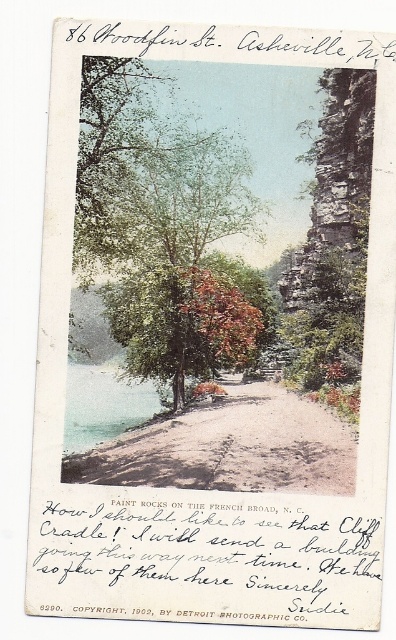
You are a hiker planning to walk along the sandy dirt path at center in the Paint Rocks area. You notice a green leafy tree at center nearby. Which object occupies more space in the scene?

The green leafy tree at center is bigger than the sandy dirt path at center, so the tree occupies more space in the scene.